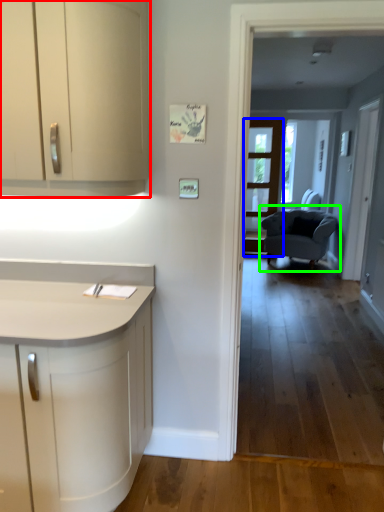
Question: Estimate the real-world distances between objects in this image. Which object is closer to cabinetry (highlighted by a red box), screen door (highlighted by a blue box) or chair (highlighted by a green box)?

Choices:
 (A) screen door
 (B) chair

Answer: (B)